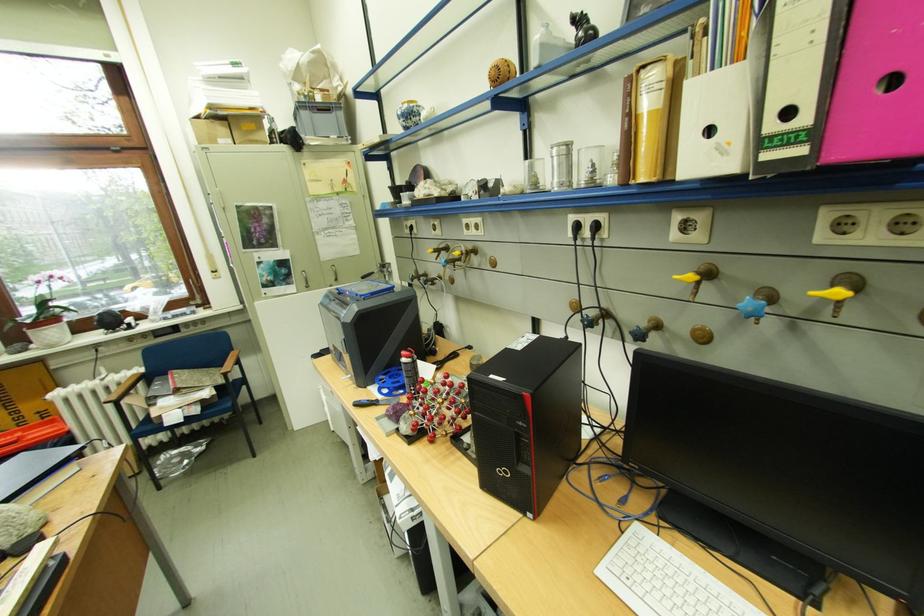
Find the location of a particular element. blue chair sitting surface is located at coordinates (180, 399).